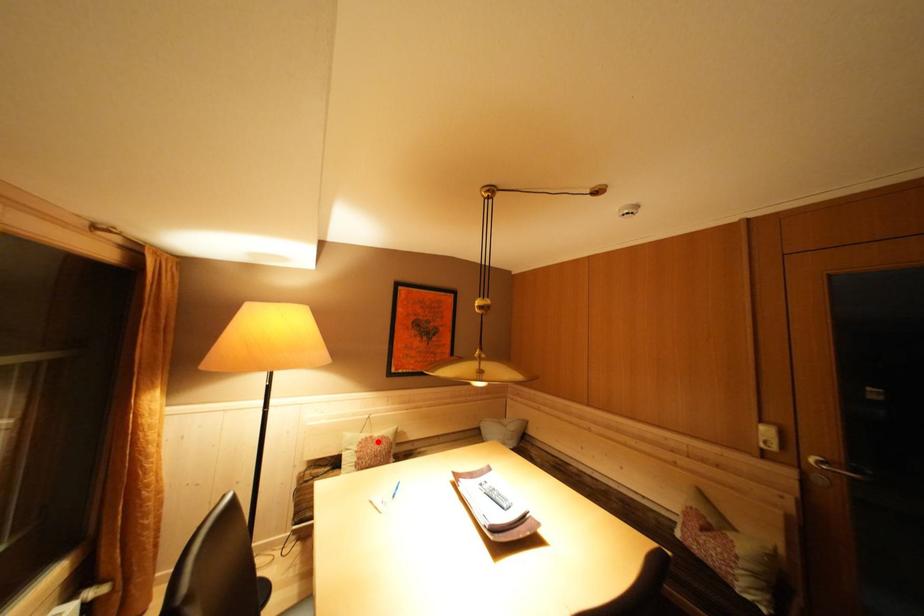
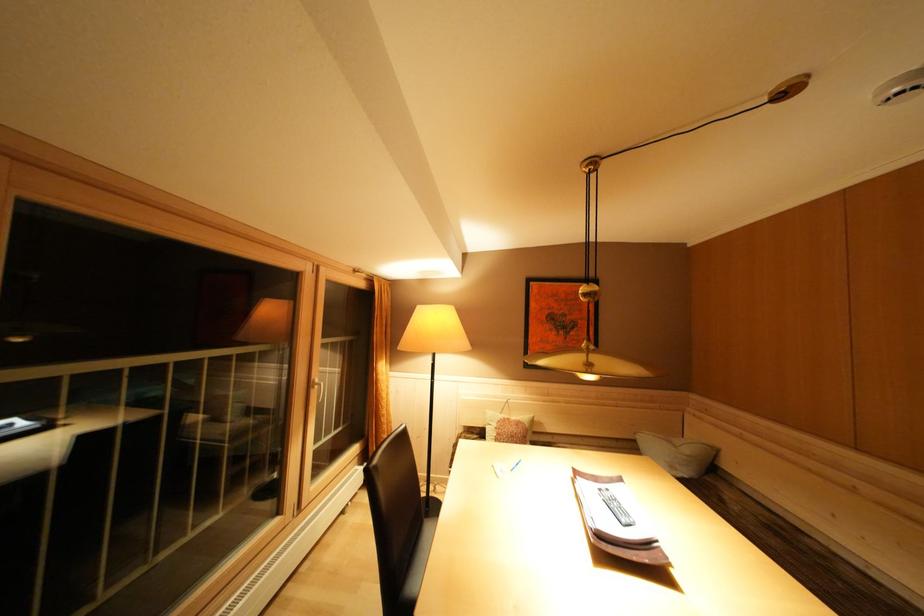
Where in the second image is the point corresponding to the highlighted location from the first image?

(515, 424)